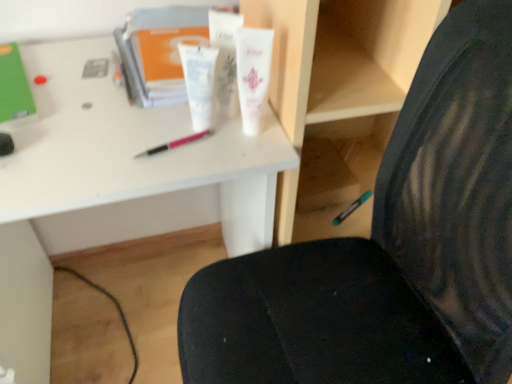
This screenshot has height=384, width=512. I want to click on free space in front of pink plastic pen at center, so click(152, 175).